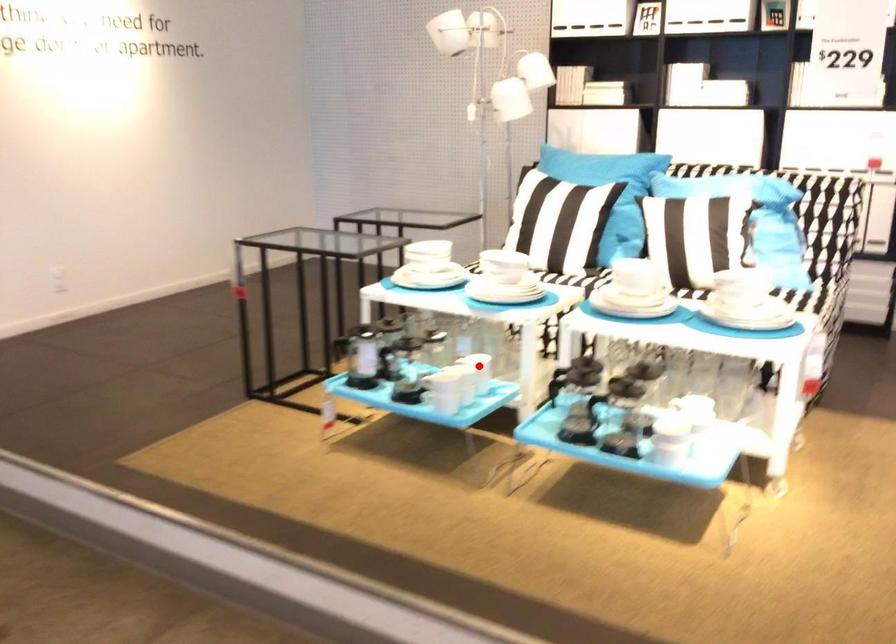
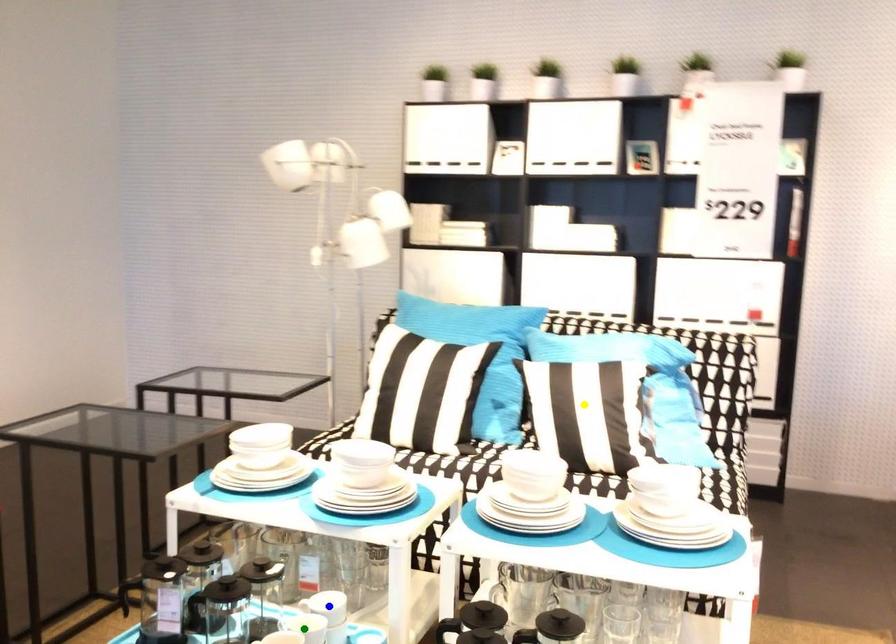
Question: I am providing you with two images of the same scene from different viewpoints. A red point is marked on the first image. You are given multiple points on the second image. Which point in image 2 is actually the same real-world point as the red point in image 1?

Choices:
 (A) blue point
 (B) yellow point
 (C) green point

Answer: (A)